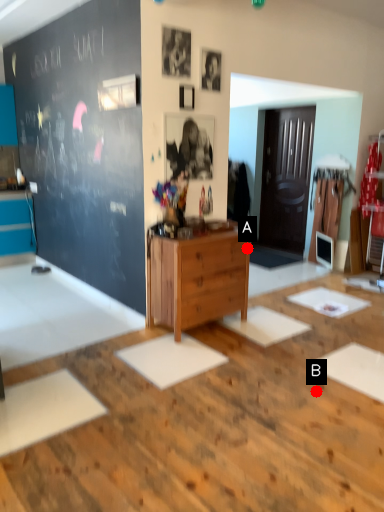
Question: Two points are circled on the image, labeled by A and B beside each circle. Which point is farther to the camera?

Choices:
 (A) A is further
 (B) B is further

Answer: (A)